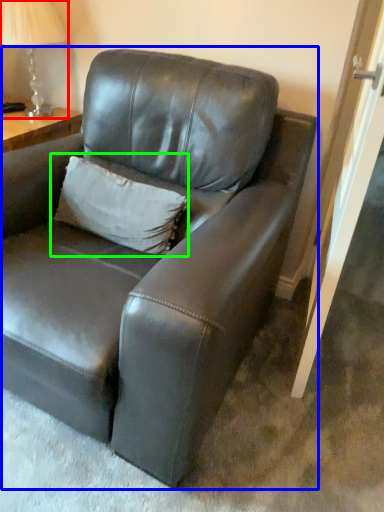
Question: Based on their relative distances, which object is farther from table lamp (highlighted by a red box)? Choose from studio couch (highlighted by a blue box) and pillow (highlighted by a green box).

Choices:
 (A) studio couch
 (B) pillow

Answer: (A)